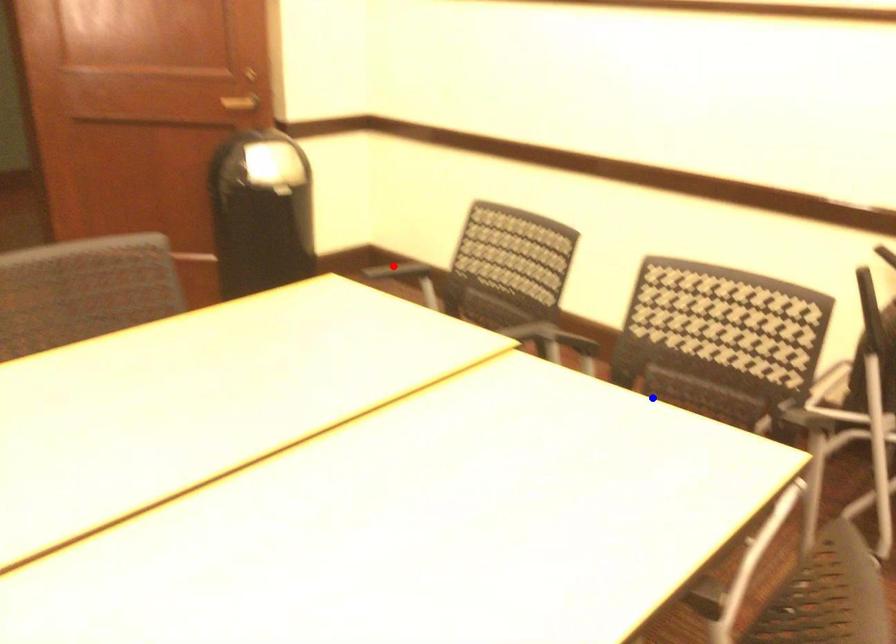
Question: Which of the two points in the image is closer to the camera?

Choices:
 (A) Blue point is closer.
 (B) Red point is closer.

Answer: (A)